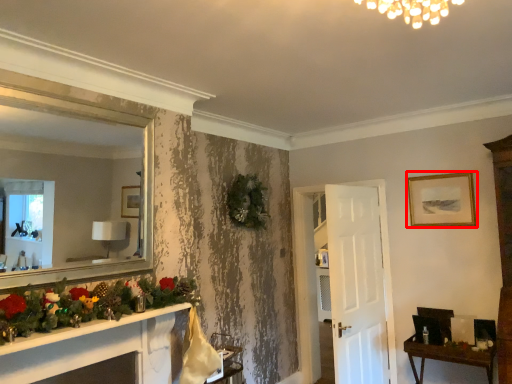
Question: Considering the relative positions of picture frame (annotated by the red box) and table in the image provided, where is picture frame (annotated by the red box) located with respect to the staircase?

Choices:
 (A) right
 (B) left

Answer: (A)